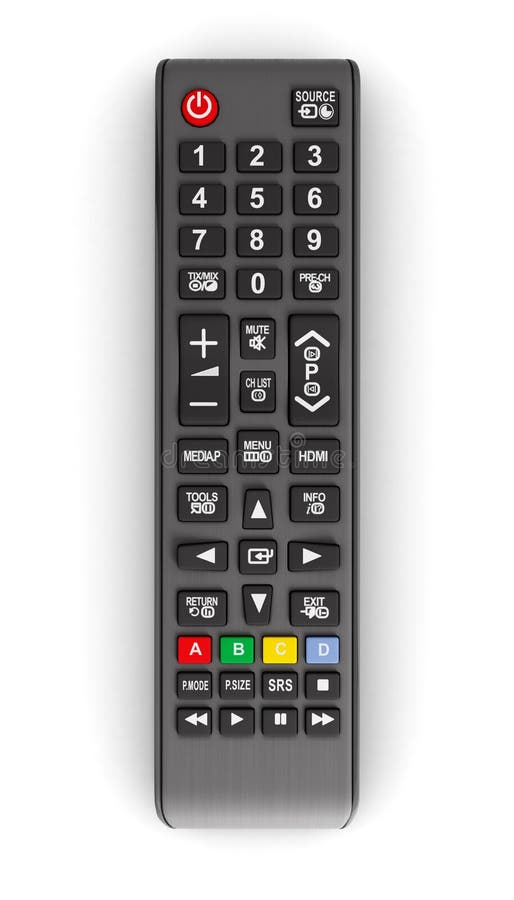
The image size is (514, 900). What are the coordinates of `buttons on the bottom of the remote` in the screenshot? It's located at (194, 718), (236, 724), (277, 721), (319, 721).